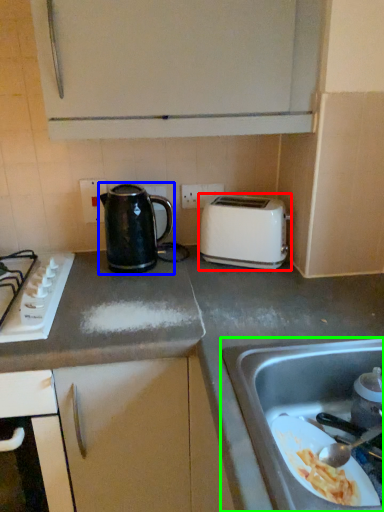
Question: Which object is positioned closest to toaster (highlighted by a red box)? Select from kettle (highlighted by a blue box) and sink (highlighted by a green box).

Choices:
 (A) kettle
 (B) sink

Answer: (A)